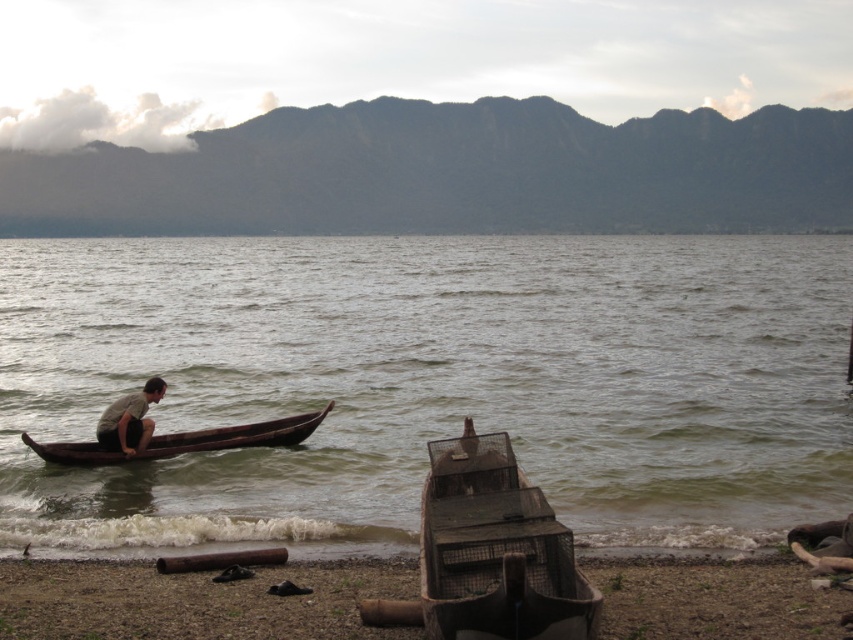
Question: Is rusty metal boat at lower center further to camera compared to dark brown wooden canoe at left?

Choices:
 (A) no
 (B) yes

Answer: (A)

Question: Does rusty metal boat at lower center have a greater width compared to rusty metal boat at lower right?

Choices:
 (A) no
 (B) yes

Answer: (B)

Question: Which point is farther to the camera?

Choices:
 (A) (125, 401)
 (B) (315, 426)

Answer: (B)

Question: Which object is the farthest from the light brown wooden boat at left?

Choices:
 (A) rusty metal boat at lower center
 (B) rusty metal boat at lower right
 (C) dark brown wooden canoe at left

Answer: (B)

Question: Does rusty metal boat at lower right come behind light brown wooden boat at left?

Choices:
 (A) yes
 (B) no

Answer: (B)

Question: Which object is positioned farthest from the rusty metal boat at lower right?

Choices:
 (A) dark brown wooden canoe at left
 (B) brown wooden water at center
 (C) light brown wooden boat at left

Answer: (B)